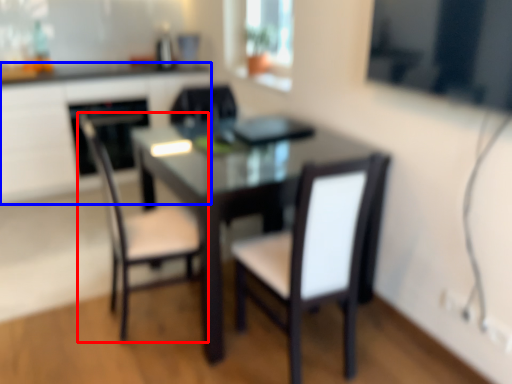
Question: Which point is closer to the camera, chair (highlighted by a red box) or computer desk (highlighted by a blue box)?

Choices:
 (A) chair
 (B) computer desk

Answer: (A)